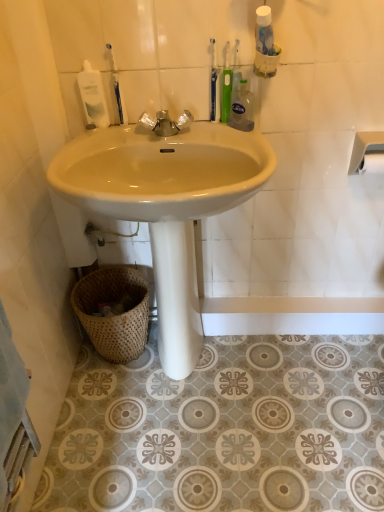
This screenshot has width=384, height=512. Identify the location of blank area to the left of green plastic toothbrush at upper center, the third toothbrush when ordered from left to right. (181, 131).